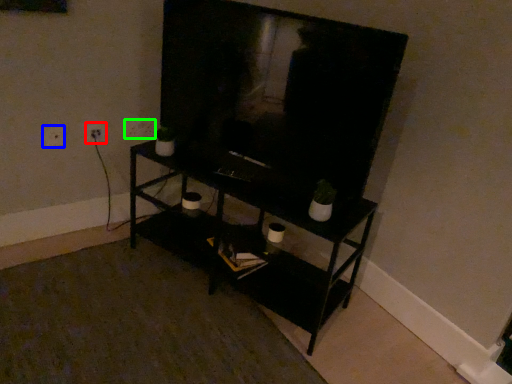
Question: Based on their relative distances, which object is farther from electric outlet (highlighted by a red box)? Choose from electric outlet (highlighted by a blue box) and electric outlet (highlighted by a green box).

Choices:
 (A) electric outlet
 (B) electric outlet

Answer: (B)